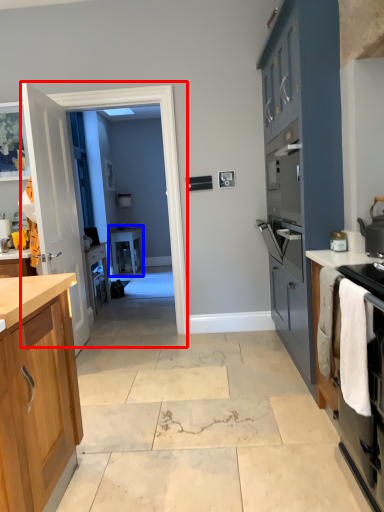
Question: Among these objects, which one is nearest to the camera, glass door (highlighted by a red box) or table (highlighted by a blue box)?

Choices:
 (A) glass door
 (B) table

Answer: (A)